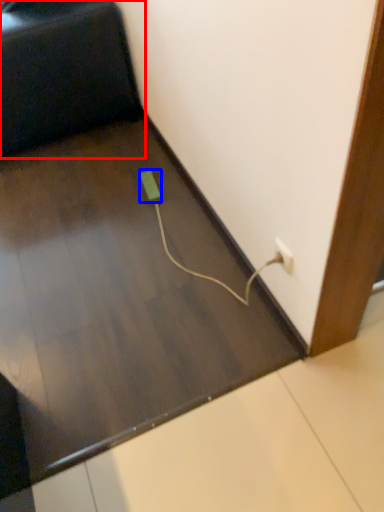
Question: Which point is further to the camera, furniture (highlighted by a red box) or socket (highlighted by a blue box)?

Choices:
 (A) furniture
 (B) socket

Answer: (B)